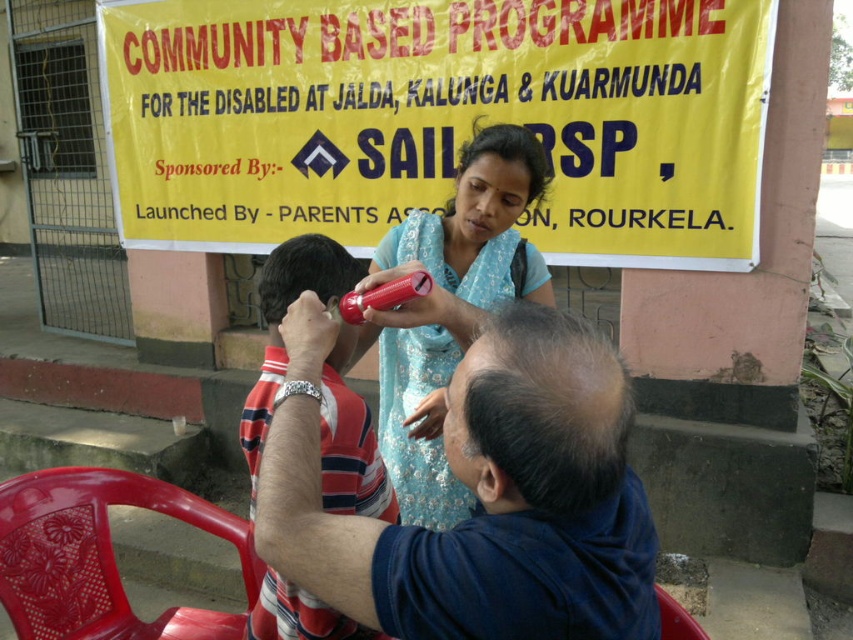
Question: Is blue cotton shirt at center closer to camera compared to blue embroidered saree at center?

Choices:
 (A) no
 (B) yes

Answer: (B)

Question: Is blue embroidered saree at center positioned behind shiny red hair clipper at center?

Choices:
 (A) yes
 (B) no

Answer: (A)

Question: Which of these objects is positioned farthest from the striped cotton shirt at center?

Choices:
 (A) shiny red hair clipper at center
 (B) dark brown hair at center
 (C) blue cotton shirt at center

Answer: (B)

Question: Which is nearer to the yellow paper sign at upper center?

Choices:
 (A) smooth plastic comb at center
 (B) striped cotton shirt at center
 (C) dark brown hair at center

Answer: (A)

Question: Which object appears farthest from the camera in this image?

Choices:
 (A) striped cotton shirt at center
 (B) smooth plastic comb at center
 (C) dark brown hair at center

Answer: (B)

Question: Is blue embroidered saree at center to the right of red plastic chair at lower left from the viewer's perspective?

Choices:
 (A) yes
 (B) no

Answer: (A)